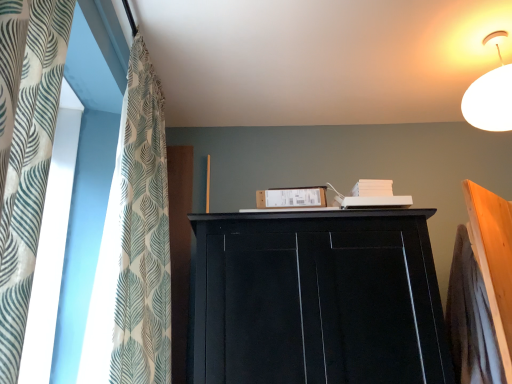
What do you see at coordinates (318, 299) in the screenshot? I see `black matte cupboard at upper center` at bounding box center [318, 299].

Find the location of a particular element. black matte cupboard at upper center is located at coordinates pyautogui.click(x=318, y=299).

In order to face black matte cupboard at upper center, should I rotate leftwards or rightwards?

It's best to rotate right around 8.641 degrees.

Measure the distance between white textured fabric at left and camera.

white textured fabric at left and camera are 1.20 meters apart.

Describe the element at coordinates (143, 234) in the screenshot. The width and height of the screenshot is (512, 384). I see `white textured fabric at left` at that location.

In the scene shown: Measure the distance between point (167, 280) and camera.

Point (167, 280) is 1.63 meters away from camera.

In order to click on white textured fabric at left in this screenshot , I will do `click(143, 234)`.

The width and height of the screenshot is (512, 384). I want to click on black matte cupboard at upper center, so click(318, 299).

Looking at this image, considering the relative positions of white textured fabric at left and black matte cupboard at upper center in the image provided, is white textured fabric at left to the left or to the right of black matte cupboard at upper center?

white textured fabric at left is positioned on black matte cupboard at upper center's left side.

In the scene shown: Which object is closer to the camera, white textured fabric at left or black matte cupboard at upper center?

white textured fabric at left is in front.

Between point (122, 215) and point (253, 231), which one is positioned in front?

Positioned in front is point (122, 215).

From the image's perspective, is white textured fabric at left on black matte cupboard at upper center?

Yes.

From a real-world perspective, who is located higher, white textured fabric at left or black matte cupboard at upper center?

In real-world perspective, white textured fabric at left is above.

Considering the sizes of objects white textured fabric at left and black matte cupboard at upper center in the image provided, who is thinner, white textured fabric at left or black matte cupboard at upper center?

white textured fabric at left.

Is white textured fabric at left taller than black matte cupboard at upper center?

Yes, white textured fabric at left is taller than black matte cupboard at upper center.

In terms of size, does white textured fabric at left appear bigger or smaller than black matte cupboard at upper center?

Clearly, white textured fabric at left is smaller in size than black matte cupboard at upper center.

Is white textured fabric at left positioned beyond the bounds of black matte cupboard at upper center?

Indeed, white textured fabric at left is completely outside black matte cupboard at upper center.

Are white textured fabric at left and black matte cupboard at upper center located far from each other?

No, white textured fabric at left is not far away from black matte cupboard at upper center.

Could you tell me if white textured fabric at left is turned towards black matte cupboard at upper center?

Yes.

How many degrees apart are the facing directions of white textured fabric at left and black matte cupboard at upper center?

92.7 degrees separate the facing orientations of white textured fabric at left and black matte cupboard at upper center.

At what (x,y) coordinates should I click in order to perform the action: click on cupboard on the right of white textured fabric at left. Please return your answer as a coordinate pair (x, y). Image resolution: width=512 pixels, height=384 pixels. Looking at the image, I should click on (318, 299).

Consider the image. Can you confirm if black matte cupboard at upper center is positioned to the left of white textured fabric at left?

No.

Is black matte cupboard at upper center closer to camera compared to white textured fabric at left?

No, the depth of black matte cupboard at upper center is greater than that of white textured fabric at left.

Is point (272, 361) farther from viewer compared to point (154, 323)?

No, (272, 361) is closer to viewer.

From the image's perspective, which is above, black matte cupboard at upper center or white textured fabric at left?

white textured fabric at left appears higher in the image.

From a real-world perspective, which is physically below, black matte cupboard at upper center or white textured fabric at left?

black matte cupboard at upper center is physically lower.

Considering the sizes of objects black matte cupboard at upper center and white textured fabric at left in the image provided, who is wider, black matte cupboard at upper center or white textured fabric at left?

black matte cupboard at upper center.

Considering the sizes of objects black matte cupboard at upper center and white textured fabric at left in the image provided, who is shorter, black matte cupboard at upper center or white textured fabric at left?

With less height is black matte cupboard at upper center.

Who is bigger, black matte cupboard at upper center or white textured fabric at left?

Bigger between the two is black matte cupboard at upper center.

Looking at this image, is black matte cupboard at upper center spatially inside white textured fabric at left, or outside of it?

black matte cupboard at upper center lies outside white textured fabric at left.

Would you consider black matte cupboard at upper center to be distant from white textured fabric at left?

No, black matte cupboard at upper center is in close proximity to white textured fabric at left.

Is black matte cupboard at upper center oriented away from white textured fabric at left?

No, black matte cupboard at upper center is not facing the opposite direction of white textured fabric at left.

Can you tell me how much black matte cupboard at upper center and white textured fabric at left differ in facing direction?

92.7 degrees separate the facing orientations of black matte cupboard at upper center and white textured fabric at left.

This screenshot has height=384, width=512. I want to click on cupboard on the right of white textured fabric at left, so [318, 299].

Locate an element on the screen. cupboard below the white textured fabric at left (from a real-world perspective) is located at coordinates (318, 299).

Identify the location of cupboard behind the white textured fabric at left. (318, 299).